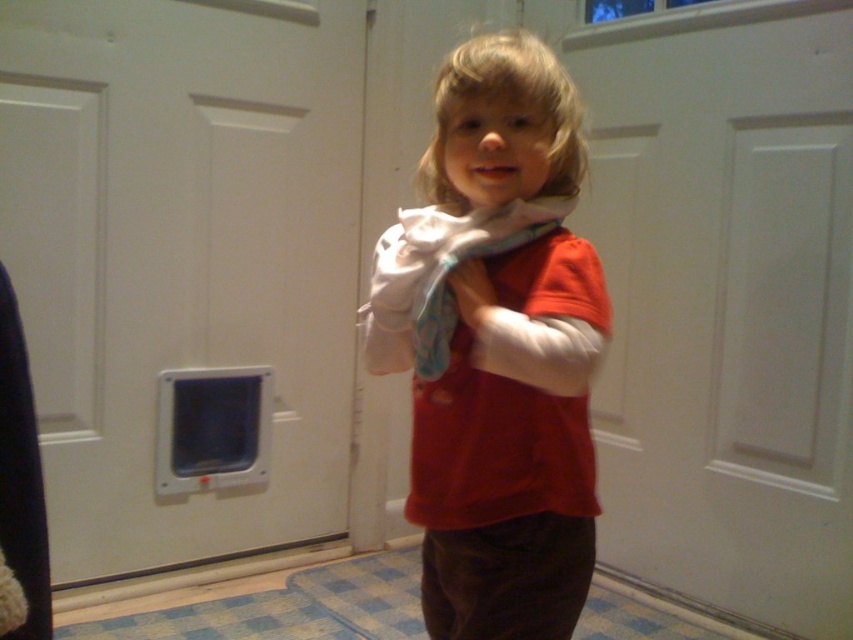
Between matte red shirt at center and white soft scarf at center, which one appears on the left side from the viewer's perspective?

Positioned to the left is white soft scarf at center.

The height and width of the screenshot is (640, 853). I want to click on matte red shirt at center, so click(511, 445).